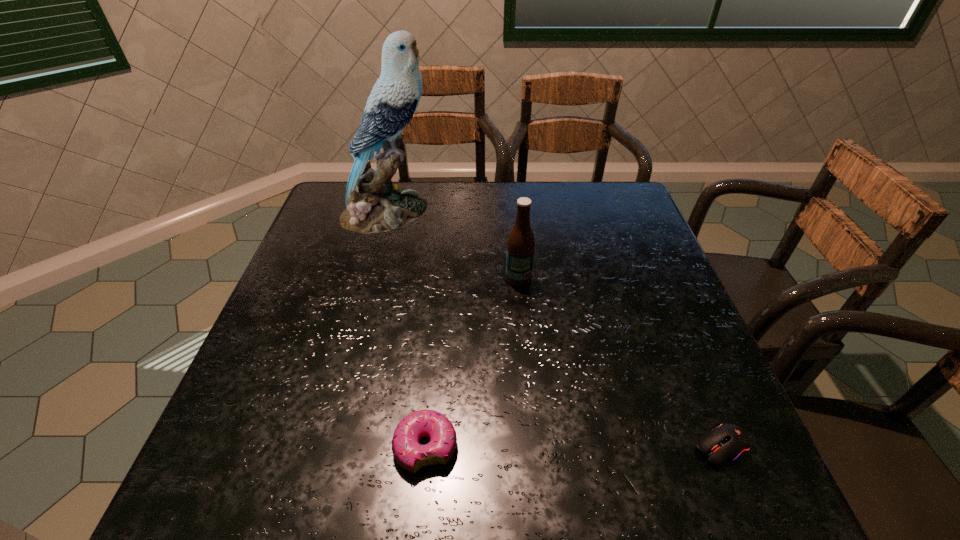
Find the location of a particular element. The image size is (960, 540). free space between the third object from left to right and the tallest object is located at coordinates (453, 245).

At what (x,y) coordinates should I click in order to perform the action: click on free spot between the parakeet and the shortest object. Please return your answer as a coordinate pair (x, y). The width and height of the screenshot is (960, 540). Looking at the image, I should click on (555, 330).

Where is `vacant space that is in between the rightmost object and the tallest object`? Image resolution: width=960 pixels, height=540 pixels. vacant space that is in between the rightmost object and the tallest object is located at coordinates (555, 330).

Where is `blank region between the third object from left to right and the computer mouse`? blank region between the third object from left to right and the computer mouse is located at coordinates (620, 363).

Locate an element on the screen. The image size is (960, 540). free space between the third nearest object and the farthest object is located at coordinates (453, 245).

What are the coordinates of `object that is the second closest to the third nearest object` in the screenshot? It's located at (412, 456).

Identify which object is the second closest to the second farthest object. Please provide its 2D coordinates. Your answer should be formatted as a tuple, i.e. [(x, y)], where the tuple contains the x and y coordinates of a point satisfying the conditions above.

[(412, 456)]

Locate an element on the screen. The height and width of the screenshot is (540, 960). vacant region that satisfies the following two spatial constraints: 1. on the face of the second farthest object; 2. on the left side of the parakeet is located at coordinates (371, 279).

Locate an element on the screen. vacant space that satisfies the following two spatial constraints: 1. on the face of the third object from left to right; 2. on the left side of the tallest object is located at coordinates (371, 279).

Find the location of a particular element. free location that satisfies the following two spatial constraints: 1. on the face of the third shortest object; 2. on the left side of the tallest object is located at coordinates (371, 279).